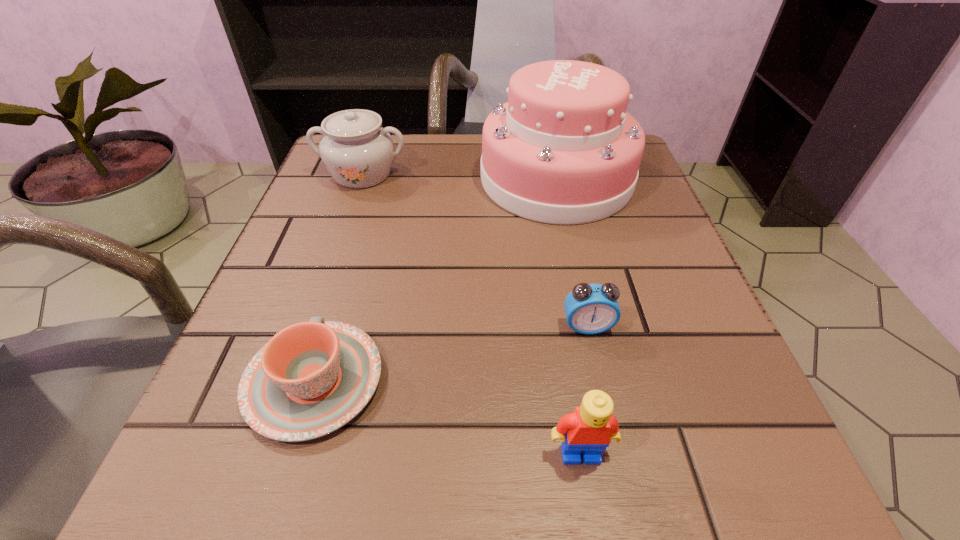
Locate an element on the screen. blank region between the Lego and the alarm clock is located at coordinates (584, 390).

Locate an element on the screen. This screenshot has width=960, height=540. empty location between the nearer chinaware and the cake is located at coordinates 435,280.

Identify the location of free space between the Lego and the alarm clock. The width and height of the screenshot is (960, 540). (584, 390).

Where is `vacant area that lies between the farther chinaware and the cake`? vacant area that lies between the farther chinaware and the cake is located at coordinates (459, 177).

At what (x,y) coordinates should I click in order to perform the action: click on vacant area that lies between the farther chinaware and the shortest object. Please return your answer as a coordinate pair (x, y). The height and width of the screenshot is (540, 960). Looking at the image, I should click on (339, 278).

Where is `free spot between the farther chinaware and the nearer chinaware`? This screenshot has width=960, height=540. free spot between the farther chinaware and the nearer chinaware is located at coordinates (339, 278).

You are a GUI agent. You are given a task and a screenshot of the screen. Output one action in this format:
    pyautogui.click(x=<x>, y=<y>)
    Task: Click on the vacant space in between the tallest object and the second shortest object
    The width and height of the screenshot is (960, 540).
    Given the screenshot: What is the action you would take?
    pyautogui.click(x=571, y=253)

Locate an element on the screen. free space between the cake and the nearer chinaware is located at coordinates (435, 280).

Locate which object is the second closest to the cake. Please provide its 2D coordinates. Your answer should be formatted as a tuple, i.e. [(x, y)], where the tuple contains the x and y coordinates of a point satisfying the conditions above.

[(590, 309)]

Identify which object is the fourth closest to the Lego. Please provide its 2D coordinates. Your answer should be formatted as a tuple, i.e. [(x, y)], where the tuple contains the x and y coordinates of a point satisfying the conditions above.

[(358, 152)]